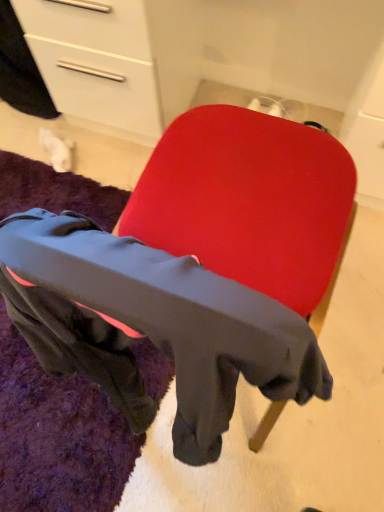
This screenshot has height=512, width=384. What do you see at coordinates (58, 437) in the screenshot?
I see `black fleece mat at lower left` at bounding box center [58, 437].

Image resolution: width=384 pixels, height=512 pixels. Find the location of `black fleece mat at lower left`. black fleece mat at lower left is located at coordinates click(58, 437).

Describe the element at coordinates (208, 261) in the screenshot. I see `matte red chair at center` at that location.

Image resolution: width=384 pixels, height=512 pixels. What are the coordinates of `matte red chair at center` in the screenshot? It's located at (208, 261).

The width and height of the screenshot is (384, 512). I want to click on black fleece mat at lower left, so click(58, 437).

Which is more to the right, matte red chair at center or black fleece mat at lower left?

From the viewer's perspective, matte red chair at center appears more on the right side.

Is matte red chair at center in front of or behind black fleece mat at lower left in the image?

Clearly, matte red chair at center is in front of black fleece mat at lower left.

Considering the points (86, 298) and (26, 453), which point is in front, point (86, 298) or point (26, 453)?

The point (86, 298) is closer.

From the image's perspective, is matte red chair at center on top of black fleece mat at lower left?

Yes, from the image's perspective, matte red chair at center is over black fleece mat at lower left.

From a real-world perspective, is matte red chair at center located higher than black fleece mat at lower left?

Yes, from a real-world perspective, matte red chair at center is on top of black fleece mat at lower left.

Considering the sizes of objects matte red chair at center and black fleece mat at lower left in the image provided, who is thinner, matte red chair at center or black fleece mat at lower left?

matte red chair at center.

Who is taller, matte red chair at center or black fleece mat at lower left?

matte red chair at center.

Considering the relative sizes of matte red chair at center and black fleece mat at lower left in the image provided, is matte red chair at center bigger than black fleece mat at lower left?

Yes, matte red chair at center is bigger than black fleece mat at lower left.

Is matte red chair at center surrounding black fleece mat at lower left?

No, matte red chair at center does not contain black fleece mat at lower left.

Is matte red chair at center not near black fleece mat at lower left?

No, matte red chair at center is in close proximity to black fleece mat at lower left.

Does matte red chair at center turn towards black fleece mat at lower left?

No.

Can you tell me how much matte red chair at center and black fleece mat at lower left differ in facing direction?

They differ by 92 degrees in their facing directions.

Identify the location of chair in front of the black fleece mat at lower left. (208, 261).

Between black fleece mat at lower left and matte red chair at center, which one appears on the left side from the viewer's perspective?

black fleece mat at lower left.

Who is more distant, black fleece mat at lower left or matte red chair at center?

Positioned behind is black fleece mat at lower left.

Which point is more forward, (50, 423) or (255, 123)?

The point (255, 123) is closer.

From the image's perspective, is black fleece mat at lower left above or below matte red chair at center?

black fleece mat at lower left is below matte red chair at center.

From a real-world perspective, who is located higher, black fleece mat at lower left or matte red chair at center?

matte red chair at center, from a real-world perspective.

Considering the sizes of black fleece mat at lower left and matte red chair at center in the image, is black fleece mat at lower left wider or thinner than matte red chair at center?

Considering their sizes, black fleece mat at lower left looks broader than matte red chair at center.

Considering the relative sizes of black fleece mat at lower left and matte red chair at center in the image provided, is black fleece mat at lower left shorter than matte red chair at center?

Indeed, black fleece mat at lower left has a lesser height compared to matte red chair at center.

Considering the relative sizes of black fleece mat at lower left and matte red chair at center in the image provided, is black fleece mat at lower left bigger than matte red chair at center?

No, black fleece mat at lower left is not bigger than matte red chair at center.

Do you think black fleece mat at lower left is within matte red chair at center, or outside of it?

black fleece mat at lower left is not inside matte red chair at center, it's outside.

Is black fleece mat at lower left not close to matte red chair at center?

That's not correct — black fleece mat at lower left is a little close to matte red chair at center.

Is black fleece mat at lower left oriented away from matte red chair at center?

No, black fleece mat at lower left's orientation is not away from matte red chair at center.

What's the angular difference between black fleece mat at lower left and matte red chair at center's facing directions?

black fleece mat at lower left and matte red chair at center are facing 92 degrees away from each other.

How much distance is there between black fleece mat at lower left and matte red chair at center?

black fleece mat at lower left and matte red chair at center are 41.19 centimeters apart.

Image resolution: width=384 pixels, height=512 pixels. I want to click on mat behind the matte red chair at center, so click(58, 437).

What are the coordinates of `mat on the left side of matte red chair at center` in the screenshot? It's located at (58, 437).

This screenshot has height=512, width=384. In order to click on chair above the black fleece mat at lower left (from a real-world perspective) in this screenshot , I will do `click(208, 261)`.